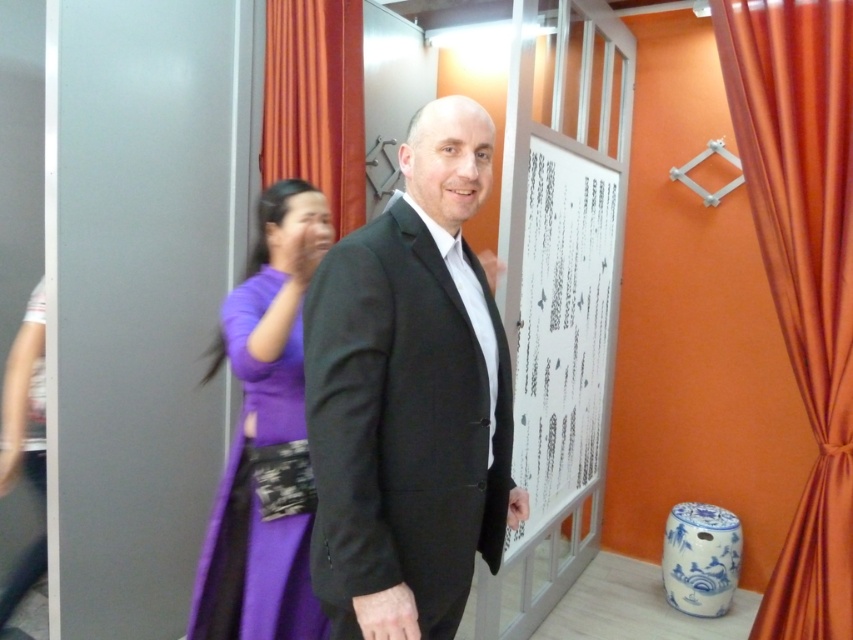
Between black matte suit at center and purple silk dress at left, which one has more height?

purple silk dress at left

Is black matte suit at center to the right of purple silk dress at left from the viewer's perspective?

Correct, you'll find black matte suit at center to the right of purple silk dress at left.

Locate an element on the screen. black matte suit at center is located at coordinates (409, 397).

Does black matte suit at center have a greater width compared to orange satin curtain at upper left?

Correct, the width of black matte suit at center exceeds that of orange satin curtain at upper left.

Is point (346, 496) in front of point (326, 28)?

Yes, it is in front of point (326, 28).

Identify the location of black matte suit at center. (409, 397).

Is white paperboard at center above orange satin curtain at upper left?

Actually, white paperboard at center is below orange satin curtain at upper left.

Between white paperboard at center and orange satin curtain at upper left, which one appears on the right side from the viewer's perspective?

From the viewer's perspective, white paperboard at center appears more on the right side.

Between point (543, 452) and point (294, 81), which one is positioned behind?

The point (543, 452) is more distant.

The width and height of the screenshot is (853, 640). I want to click on white paperboard at center, so click(x=561, y=326).